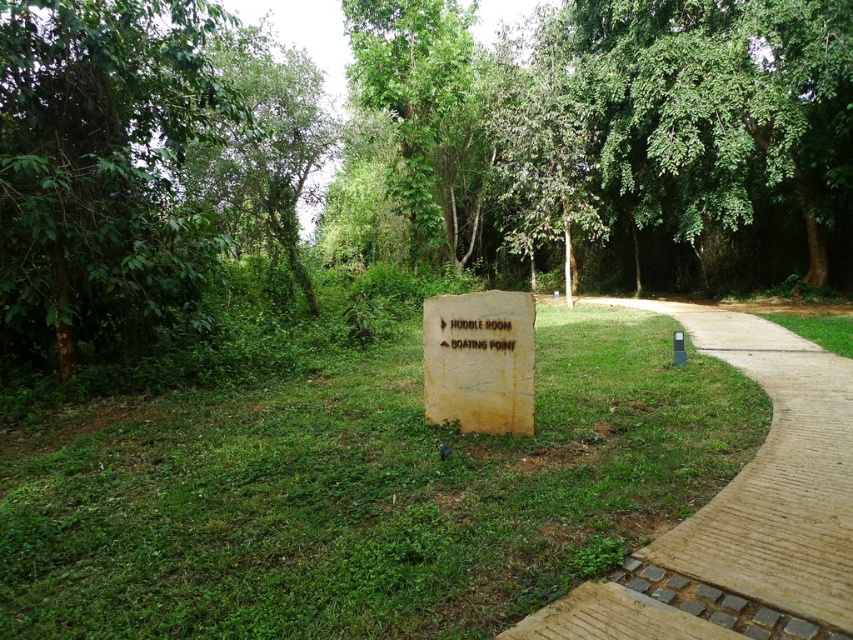
Is point (762, 563) positioned behind point (509, 396)?

No, it is in front of (509, 396).

Describe the element at coordinates (741, 512) in the screenshot. I see `light brown paved path at center right` at that location.

Locate an element on the screen. The image size is (853, 640). light brown paved path at center right is located at coordinates (741, 512).

Which is in front, point (846, 401) or point (380, 90)?

Positioned in front is point (846, 401).

Consider the image. Does light brown paved path at center right have a lesser height compared to green leafy tree at upper center?

Indeed, light brown paved path at center right has a lesser height compared to green leafy tree at upper center.

Where is `light brown paved path at center right`? light brown paved path at center right is located at coordinates (741, 512).

Is green grassy at center above light brown paved path at center right?

Incorrect, green grassy at center is not positioned above light brown paved path at center right.

Where is `green grassy at center`? The width and height of the screenshot is (853, 640). green grassy at center is located at coordinates (363, 493).